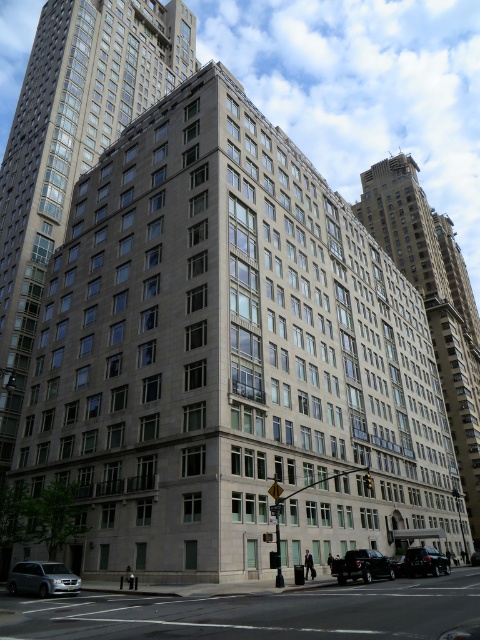
Question: Which object appears farthest from the camera in this image?

Choices:
 (A) smooth concrete building at center
 (B) gray stone building at center

Answer: (A)

Question: Is smooth concrete building at center wider than shiny black sedan at center?

Choices:
 (A) no
 (B) yes

Answer: (B)

Question: Is gray stone building at center above shiny black car at lower right?

Choices:
 (A) no
 (B) yes

Answer: (B)

Question: Among these points, which one is nearest to the camera?

Choices:
 (A) pyautogui.click(x=407, y=561)
 (B) pyautogui.click(x=458, y=269)
 (C) pyautogui.click(x=475, y=550)

Answer: (A)

Question: Which object appears farthest from the camera in this image?

Choices:
 (A) shiny black sedan at center
 (B) shiny black car at lower right
 (C) smooth concrete building at center

Answer: (C)

Question: Considering the relative positions of silver metallic van at lower left and shiny black truck at lower right in the image provided, where is silver metallic van at lower left located with respect to shiny black truck at lower right?

Choices:
 (A) right
 (B) left

Answer: (B)